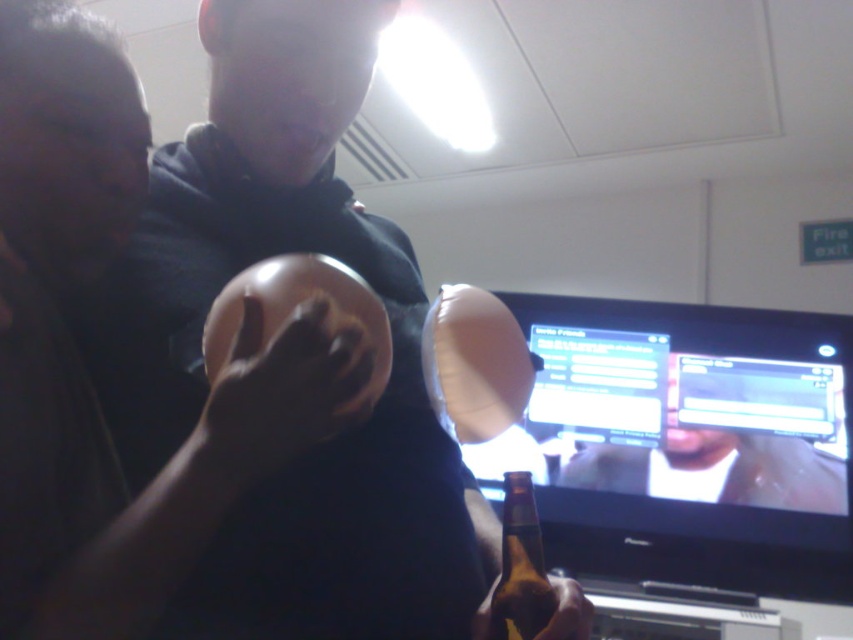
You are setting up a photo shoot in this room and need to position a light source to the right of both the matte brown helmet at center and the matte plastic monitor at center. Is there enough space to place the light source to the right of both objects?

The matte brown helmet at center is to the left of the matte plastic monitor at center, so the monitor is already positioned to the right of the helmet. Therefore, placing the light source to the right of both would require space beyond the monitor, which may or may not be available depending on the room layout. However, based on the given information, we cannot confirm if there is sufficient space beyond the monitor to place the light source to the right of both objects.

You are a guest at this gathering and want to place your drink on the table. The brown glass bottle at lower center is already there. Can you put another drink next to it without moving the existing bottle? Please consider the size of the matte brown helmet at center.

The matte brown helmet at center is larger than the brown glass bottle at lower center. Since the helmet is bigger, there might not be enough space left on the table next to the bottle for another drink without moving the existing bottle.

You are a guest at this event and want to place a small item on the surface where the matte brown helmet at center and the brown glass bottle at lower center are located. Which object should you place it in front of to ensure it stays visible?

You should place the small item in front of the brown glass bottle at lower center because the matte brown helmet at center is already in front of it, so placing the item in front of the bottle would keep it visible.